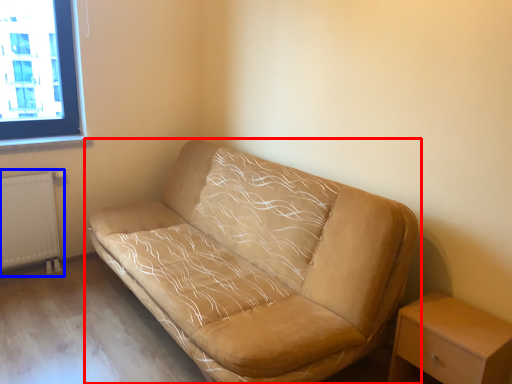
Question: Which point is further to the camera, studio couch (highlighted by a red box) or radiator (highlighted by a blue box)?

Choices:
 (A) studio couch
 (B) radiator

Answer: (B)